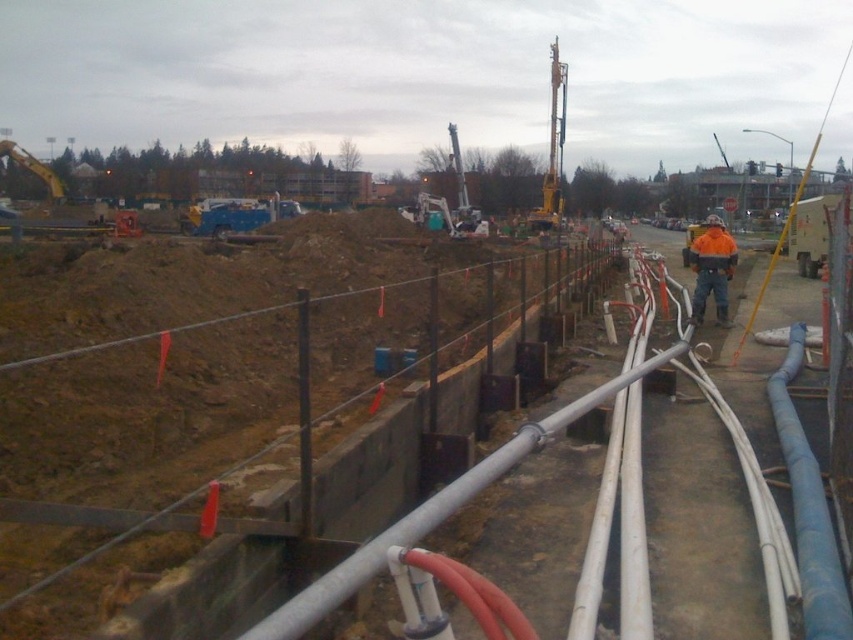
Question: Is blue rubber hose at center right further to camera compared to yellow metallic drill at upper center?

Choices:
 (A) no
 (B) yes

Answer: (A)

Question: Is orange reflective jacket at center above yellow metallic drill at upper center?

Choices:
 (A) yes
 (B) no

Answer: (B)

Question: Is blue rubber hose at center right closer to the viewer compared to yellow metallic drill at upper center?

Choices:
 (A) yes
 (B) no

Answer: (A)

Question: Which point appears farthest from the camera in this image?

Choices:
 (A) (706, 248)
 (B) (624, 560)
 (C) (553, 125)

Answer: (C)

Question: Which object is the farthest from the yellow metallic drill at upper center?

Choices:
 (A) orange reflective jacket at center
 (B) white plastic pipes at center

Answer: (B)

Question: Which object is positioned closest to the yellow metallic drill at upper center?

Choices:
 (A) blue rubber hose at center right
 (B) white plastic pipes at center

Answer: (B)